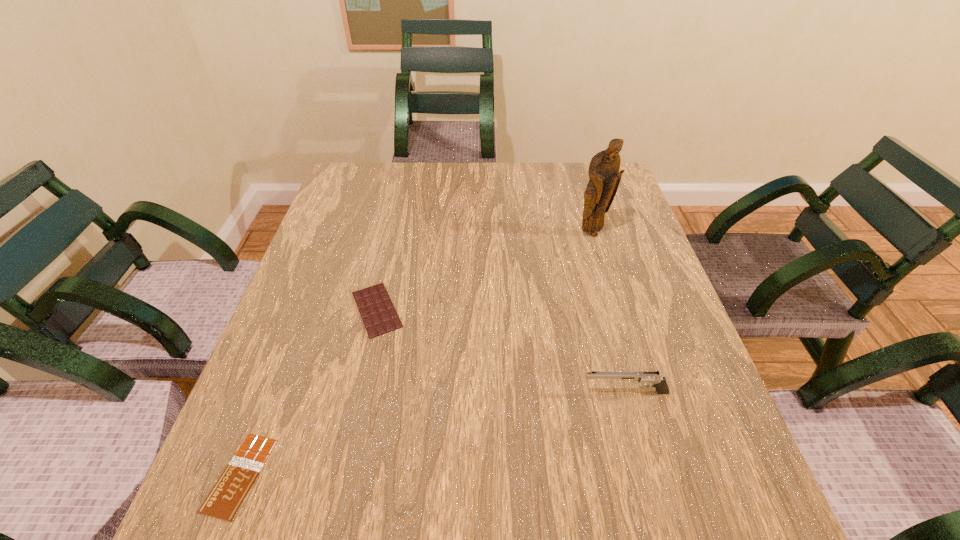
This screenshot has height=540, width=960. In the image, there is a desktop. Identify the location of vacant space at the left edge. (303, 446).

This screenshot has width=960, height=540. In the image, there is a desktop. In order to click on free region at the right edge in this screenshot , I will do `click(707, 421)`.

Locate an element on the screen. The height and width of the screenshot is (540, 960). vacant space at the far left corner of the desktop is located at coordinates (367, 181).

The height and width of the screenshot is (540, 960). What are the coordinates of `vacant space at the near left corner of the desktop` in the screenshot? It's located at (244, 518).

Identify the location of empty space that is in between the third farthest object and the farthest object. (608, 313).

At what (x,y) coordinates should I click in order to perform the action: click on vacant area between the tallest object and the nearest object. Please return your answer as a coordinate pair (x, y). Looking at the image, I should click on (416, 354).

Locate an element on the screen. free point between the farther chocolate bar and the farthest object is located at coordinates (484, 272).

Identify the location of free area in between the tallest object and the shorter chocolate bar. (416, 354).

This screenshot has height=540, width=960. In order to click on free space that is in between the nearest object and the farthest object in this screenshot , I will do `click(416, 354)`.

Find the location of a particular element. This screenshot has height=540, width=960. empty space between the tallest object and the third shortest object is located at coordinates (608, 313).